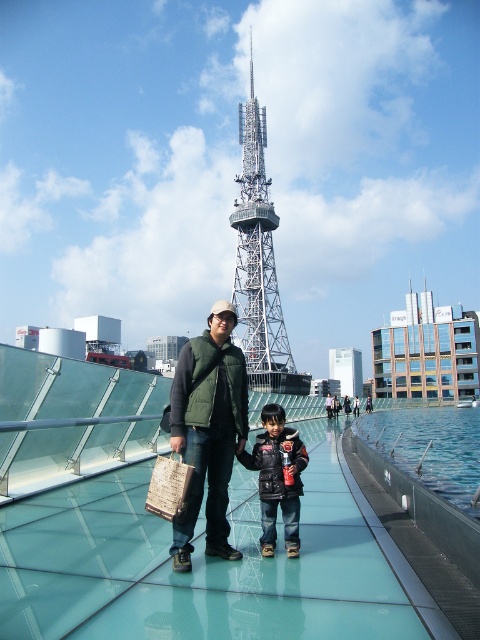
Question: Among these objects, which one is farthest from the camera?

Choices:
 (A) green fabric vest at center
 (B) black leather jacket at center

Answer: (B)

Question: Which object is closer to the camera taking this photo?

Choices:
 (A) metallic lattice tower at center
 (B) black leather jacket at center
 (C) green fabric vest at center

Answer: (C)

Question: Is the position of green fabric vest at center less distant than that of metallic lattice tower at center?

Choices:
 (A) no
 (B) yes

Answer: (B)

Question: Which point appears closest to the camera in this image?

Choices:
 (A) (197, 387)
 (B) (269, 480)
 (C) (244, 100)

Answer: (B)

Question: Is green fabric vest at center to the left of metallic lattice tower at center from the viewer's perspective?

Choices:
 (A) no
 (B) yes

Answer: (B)

Question: Can you confirm if metallic lattice tower at center is positioned above black leather jacket at center?

Choices:
 (A) yes
 (B) no

Answer: (A)